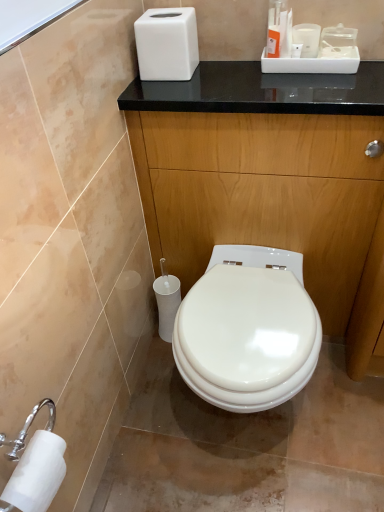
Question: Is white matte toilet paper at lower left, arranged as the first toilet paper when viewed from the left, aimed at white matte tissue box at upper center?

Choices:
 (A) no
 (B) yes

Answer: (A)

Question: Is white matte toilet paper at lower left, marked as the second toilet paper in a top-to-bottom arrangement, outside of white matte tissue box at upper center?

Choices:
 (A) yes
 (B) no

Answer: (A)

Question: Is white matte toilet paper at lower left, marked as the 1th toilet paper in a bottom-to-top arrangement, in front of white matte tissue box at upper center?

Choices:
 (A) no
 (B) yes

Answer: (B)

Question: From a real-world perspective, is white matte toilet paper at lower left, arranged as the first toilet paper when viewed from the left, below white matte tissue box at upper center?

Choices:
 (A) no
 (B) yes

Answer: (B)

Question: Is white matte toilet paper at lower left, the 2th toilet paper viewed from the back, touching white matte tissue box at upper center?

Choices:
 (A) yes
 (B) no

Answer: (B)

Question: Considering the positions of glossy wood dresser at center and white matte tissue box at upper center in the image, is glossy wood dresser at center wider or thinner than white matte tissue box at upper center?

Choices:
 (A) thin
 (B) wide

Answer: (B)

Question: Considering the positions of glossy wood dresser at center and white matte tissue box at upper center in the image, is glossy wood dresser at center bigger or smaller than white matte tissue box at upper center?

Choices:
 (A) big
 (B) small

Answer: (A)

Question: Is glossy wood dresser at center inside or outside of white matte tissue box at upper center?

Choices:
 (A) outside
 (B) inside

Answer: (A)

Question: Relative to white matte tissue box at upper center, is glossy wood dresser at center in front or behind?

Choices:
 (A) front
 (B) behind

Answer: (A)

Question: Is glossy wood dresser at center situated inside white plastic toilet paper at lower left, which ranks as the second toilet paper in left-to-right order, or outside?

Choices:
 (A) inside
 (B) outside

Answer: (B)

Question: From the image's perspective, is glossy wood dresser at center positioned above or below white plastic toilet paper at lower left, which ranks as the second toilet paper in left-to-right order?

Choices:
 (A) below
 (B) above

Answer: (B)

Question: Looking at their shapes, would you say glossy wood dresser at center is wider or thinner than white plastic toilet paper at lower left, which appears as the first toilet paper when viewed from the back?

Choices:
 (A) thin
 (B) wide

Answer: (B)

Question: Is glossy wood dresser at center taller or shorter than white plastic toilet paper at lower left, arranged as the 2th toilet paper when viewed from the front?

Choices:
 (A) short
 (B) tall

Answer: (B)

Question: From the image's perspective, is white matte toilet paper at lower left, marked as the 1th toilet paper in a bottom-to-top arrangement, above or below white plastic toilet paper at lower left, the 1th toilet paper positioned from the right?

Choices:
 (A) below
 (B) above

Answer: (A)

Question: From a real-world perspective, relative to white plastic toilet paper at lower left, marked as the 1th toilet paper in a top-to-bottom arrangement, is white matte toilet paper at lower left, which is the 1th toilet paper in front-to-back order, vertically above or below?

Choices:
 (A) below
 (B) above

Answer: (B)